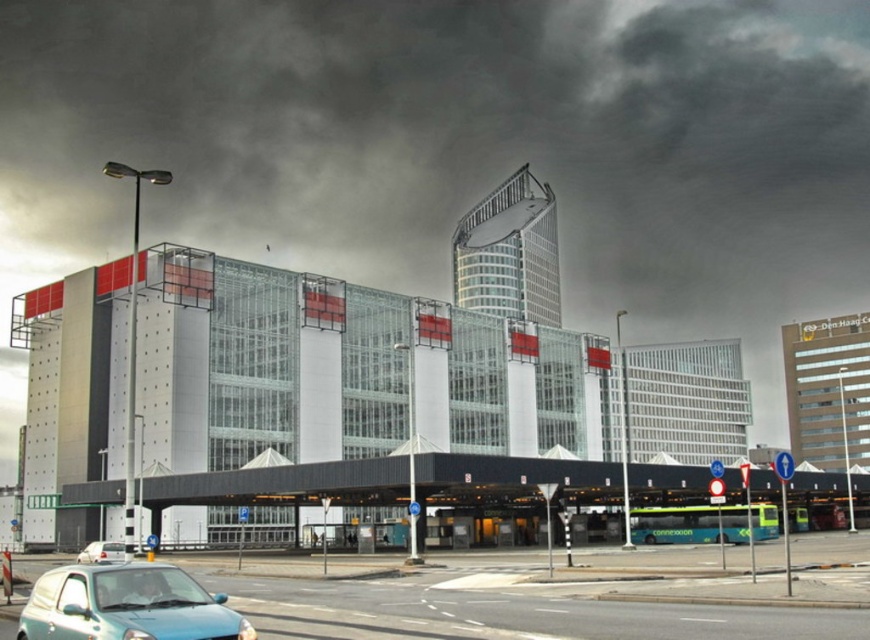
The width and height of the screenshot is (870, 640). What do you see at coordinates (126, 605) in the screenshot?
I see `teal matte car at lower left` at bounding box center [126, 605].

Between teal matte car at lower left and white matte van at lower left, which one is positioned higher?

teal matte car at lower left

The image size is (870, 640). What do you see at coordinates (126, 605) in the screenshot? I see `teal matte car at lower left` at bounding box center [126, 605].

Identify the location of teal matte car at lower left. This screenshot has height=640, width=870. (126, 605).